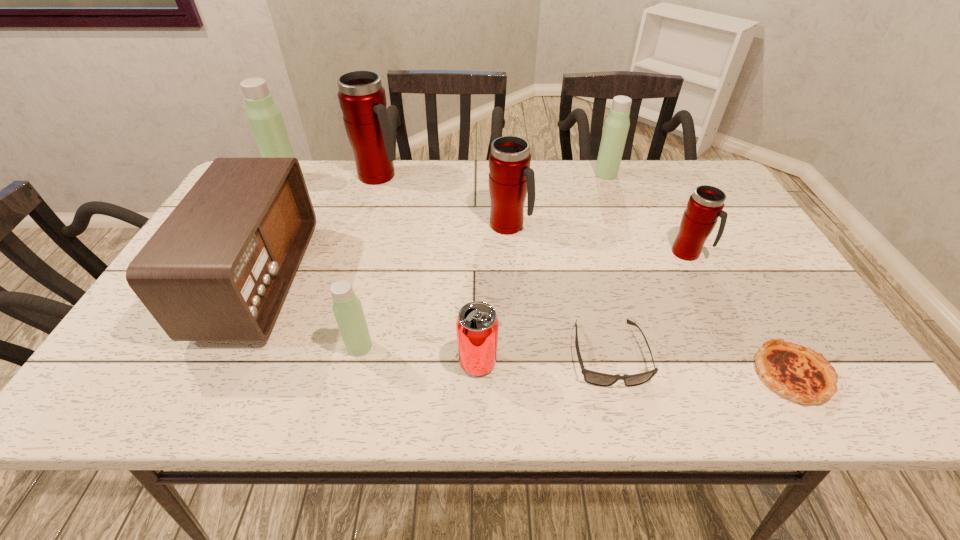
Identify the location of free spot that satisfies the following two spatial constraints: 1. on the back side of the shortest object; 2. on the front-facing side of the radio receiver. Image resolution: width=960 pixels, height=540 pixels. (737, 281).